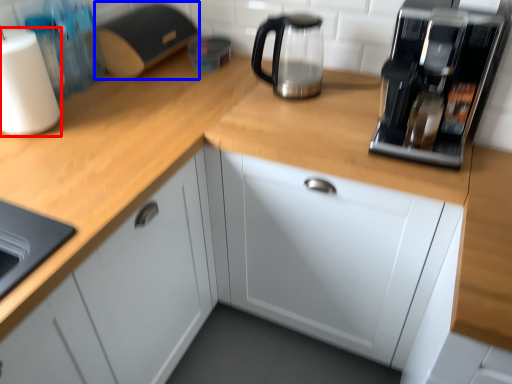
Question: Which of the following is the farthest to the observer, paper towel (highlighted by a red box) or appliance (highlighted by a blue box)?

Choices:
 (A) paper towel
 (B) appliance

Answer: (B)